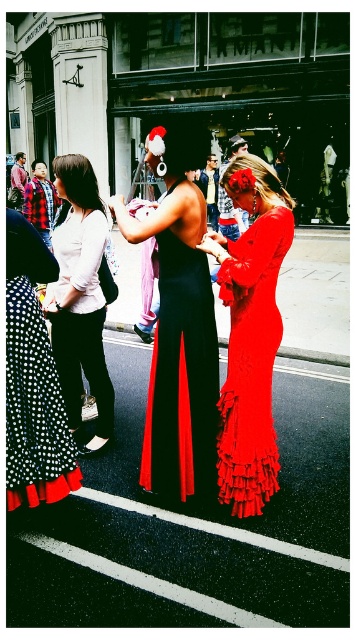
Question: Is matte black dress at center smaller than black polka dot fabric dress at lower left?

Choices:
 (A) yes
 (B) no

Answer: (B)

Question: From the image, what is the correct spatial relationship of matte black dress at center in relation to white matte blouse at left?

Choices:
 (A) left
 (B) right

Answer: (B)

Question: Which point is farther to the camera?

Choices:
 (A) silky red dress at center
 (B) black polka dot fabric dress at lower left

Answer: (A)

Question: Where is matte black dress at center located in relation to silky red dress at center in the image?

Choices:
 (A) left
 (B) right

Answer: (A)

Question: Among these objects, which one is nearest to the camera?

Choices:
 (A) matte black dress at center
 (B) silky red dress at center
 (C) white matte blouse at left
 (D) black polka dot fabric dress at lower left

Answer: (A)

Question: Which of the following is the farthest from the observer?

Choices:
 (A) silky red dress at center
 (B) white matte blouse at left

Answer: (B)